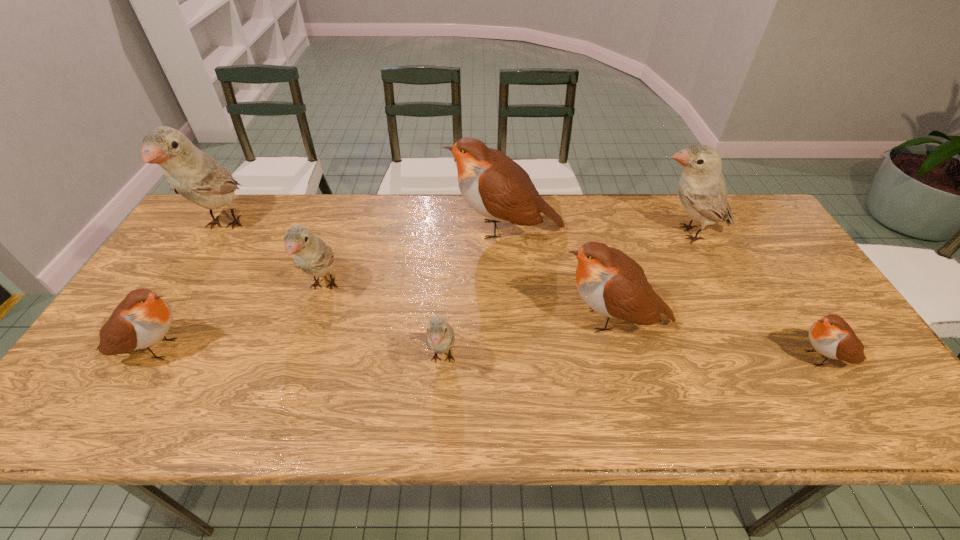
The height and width of the screenshot is (540, 960). Identify the location of free space at the far edge. (642, 199).

This screenshot has height=540, width=960. In order to click on vacant region at the near edge of the desktop in this screenshot , I will do `click(406, 402)`.

Locate an element on the screen. The height and width of the screenshot is (540, 960). vacant space at the left edge of the desktop is located at coordinates (100, 362).

Find the location of a particular element. vacant space at the right edge of the desktop is located at coordinates (811, 314).

In the image, there is a desktop. Identify the location of free region at the far left corner. Image resolution: width=960 pixels, height=540 pixels. (234, 205).

What are the coordinates of `vacant space at the near left corner` in the screenshot? It's located at (71, 400).

Image resolution: width=960 pixels, height=540 pixels. In order to click on free point at the far right corner in this screenshot , I will do `click(718, 228)`.

Where is `empty space that is in between the shortest bird and the rightmost white bird`? empty space that is in between the shortest bird and the rightmost white bird is located at coordinates (756, 296).

The image size is (960, 540). Identify the location of unoccupied position between the farthest brown bird and the biggest white bird. (365, 227).

The width and height of the screenshot is (960, 540). I want to click on free space between the biggest brown bird and the third white bird from right to left, so click(415, 258).